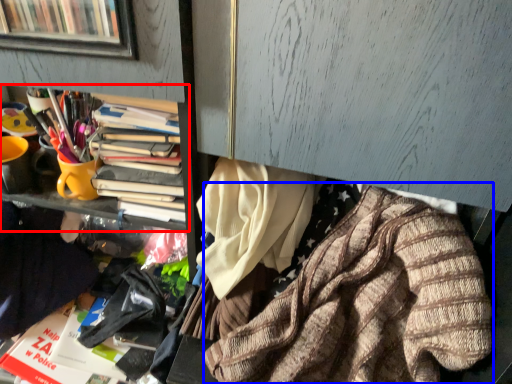
Question: Which object is closer to the camera taking this photo, bookcase (highlighted by a red box) or clothing (highlighted by a blue box)?

Choices:
 (A) bookcase
 (B) clothing

Answer: (B)